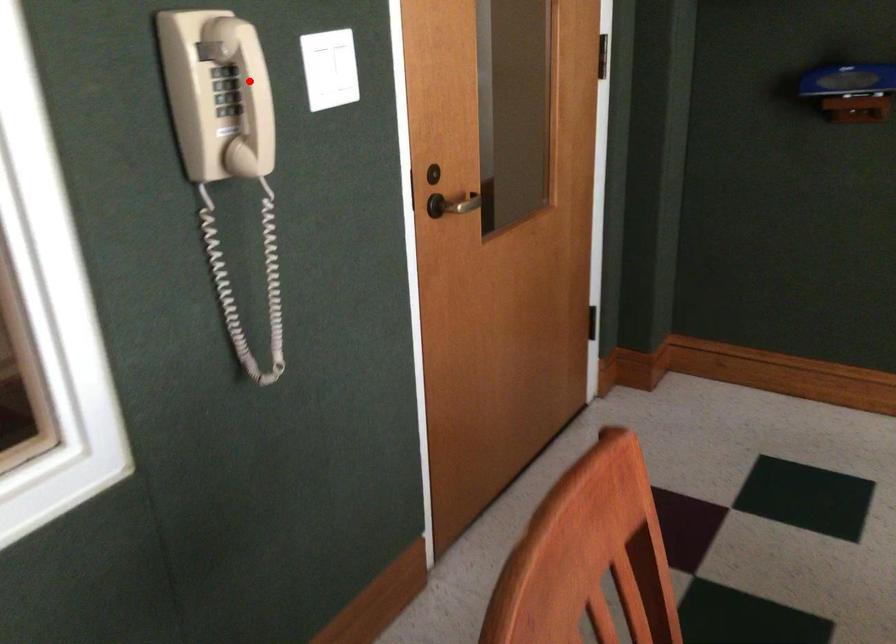
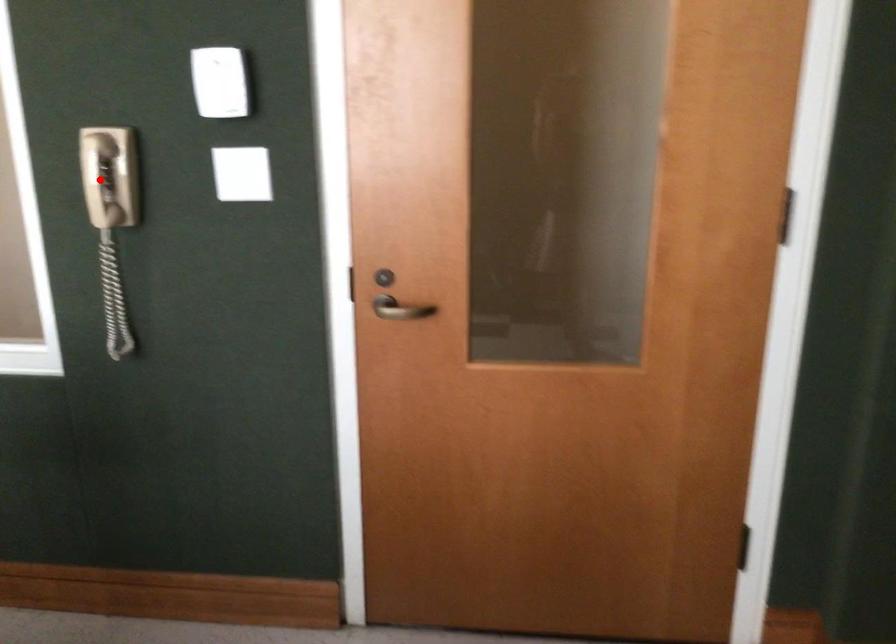
I am providing you with two images of the same scene from different viewpoints. A red point is marked on the first image and another point is marked on the second image. Is the red point in image1 aligned with the point shown in image2?

Yes